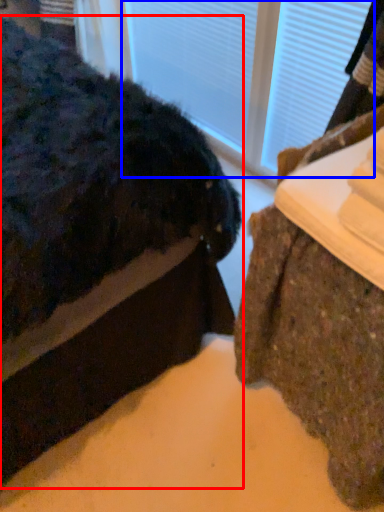
Question: Which object appears closest to the camera in this image, furniture (highlighted by a red box) or glass door (highlighted by a blue box)?

Choices:
 (A) furniture
 (B) glass door

Answer: (A)